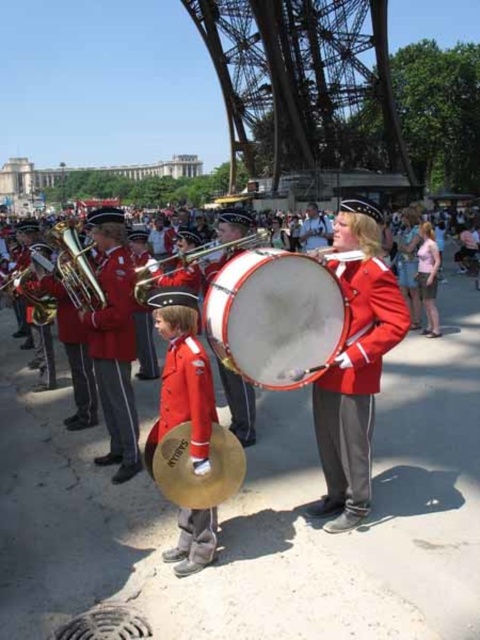
Question: Which of the following is the farthest from the observer?

Choices:
 (A) (62, 228)
 (B) (183, 369)

Answer: (A)

Question: Among these points, which one is nearest to the camera?

Choices:
 (A) (120, 460)
 (B) (418, 266)
 (C) (48, 304)
 (D) (324, 330)

Answer: (D)

Question: Is shiny brass drum at center bigger than brass tuba at center?

Choices:
 (A) yes
 (B) no

Answer: (A)

Question: Which is nearer to the brushed metal tuba at left?

Choices:
 (A) shiny brass drum at center
 (B) matte red uniform at center
 (C) brass cymbal at center
 (D) white matte drum at center

Answer: (D)

Question: Does shiny brass drum at center appear under brushed metal tuba at left?

Choices:
 (A) no
 (B) yes

Answer: (B)

Question: Does red smooth uniform at center appear under brushed metal tuba at left?

Choices:
 (A) yes
 (B) no

Answer: (A)